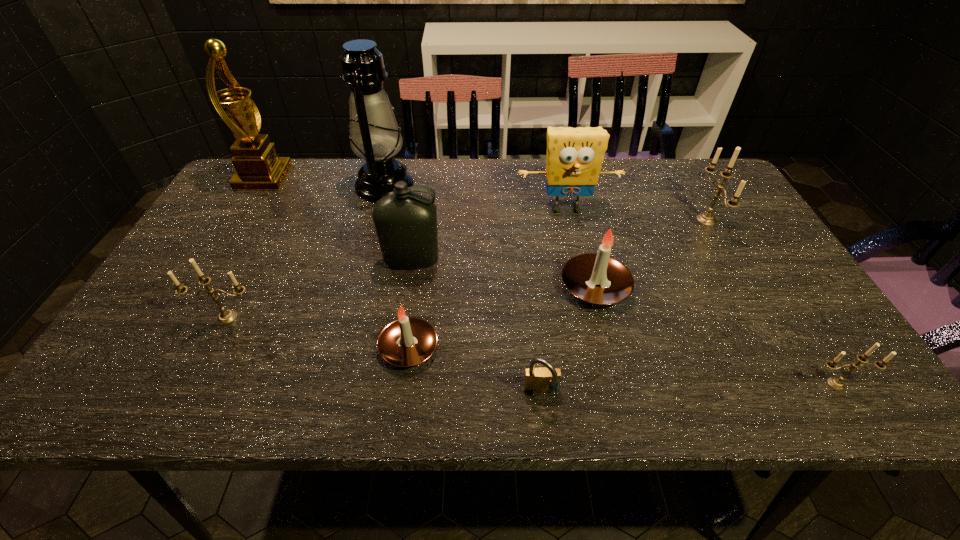
What are the coordinates of `the second candle from left to right` in the screenshot? It's located at (408, 341).

Identify the location of the nearer white candle. This screenshot has width=960, height=540. (408, 341).

You are a GUI agent. You are given a task and a screenshot of the screen. Output one action in this format:
    pyautogui.click(x=<x>, y=<y>)
    Task: Click on the nearest metallic candle
    This screenshot has width=960, height=540.
    Given the screenshot: What is the action you would take?
    pyautogui.click(x=837, y=384)

Locate an element on the screen. The height and width of the screenshot is (540, 960). the smallest metallic candle is located at coordinates (837, 384).

At what (x,y) coordinates should I click in order to perform the action: click on padlock. Please return your answer as a coordinate pair (x, y). This screenshot has height=540, width=960. Looking at the image, I should click on (537, 380).

At what (x,y) coordinates should I click in order to perform the action: click on vacant space situated 0.080m on the left of the black oil lamp. Please return your answer as a coordinate pair (x, y). The image size is (960, 540). Looking at the image, I should click on (329, 186).

The height and width of the screenshot is (540, 960). I want to click on vacant space located on the front-facing side of the gold award, so click(315, 178).

You are a GUI agent. You are given a task and a screenshot of the screen. Output one action in this format:
    pyautogui.click(x=<x>, y=<y>)
    Task: Click on the vacant space located on the face of the sponge
    The width and height of the screenshot is (960, 540).
    Given the screenshot: What is the action you would take?
    pyautogui.click(x=590, y=318)

This screenshot has width=960, height=540. Find the location of `vacant space located on the left of the bottle`. vacant space located on the left of the bottle is located at coordinates (300, 261).

Find the location of a particular element. The width and height of the screenshot is (960, 540). vacant space located on the back of the tallest candle is located at coordinates (682, 178).